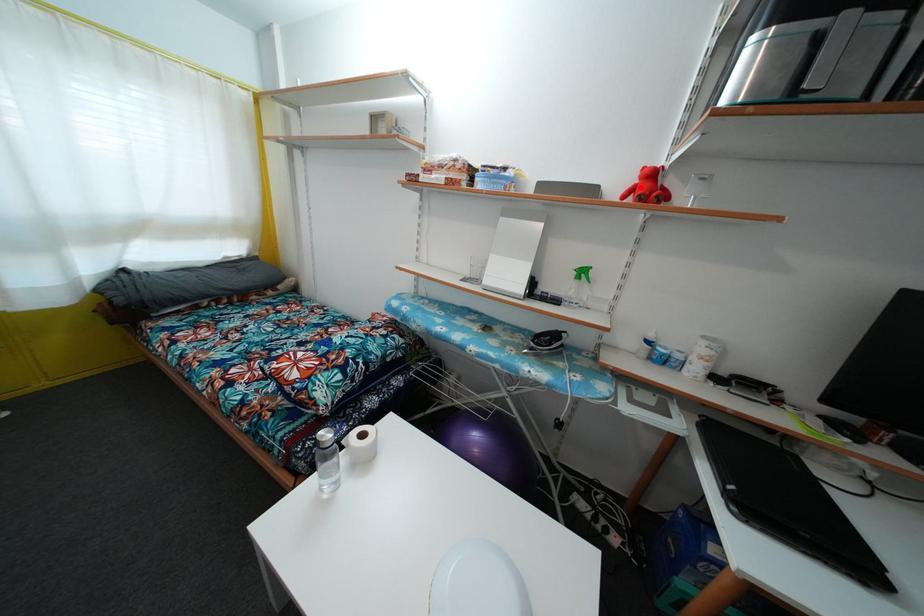
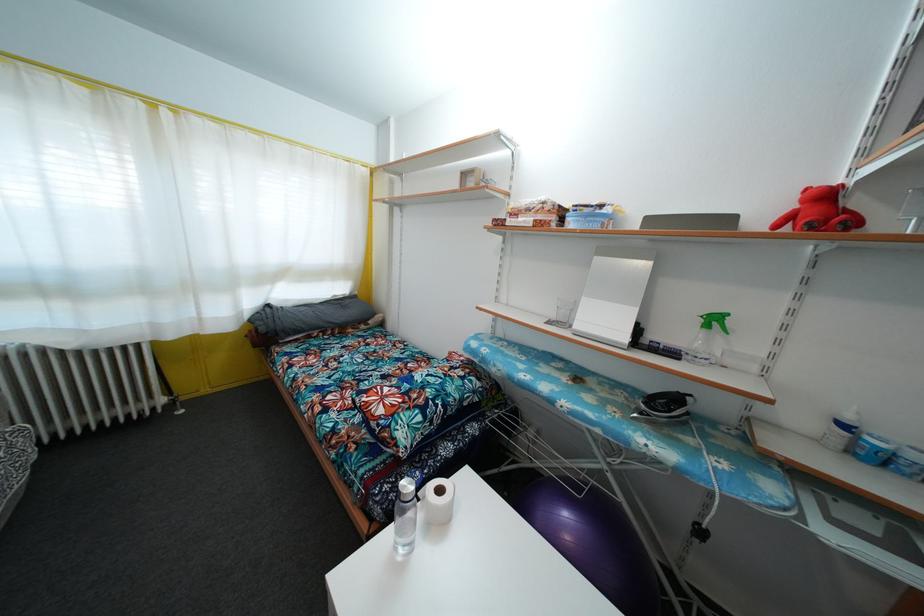
The point at the highlighted location is marked in the first image. Where is the corresponding point in the second image?

(800, 213)